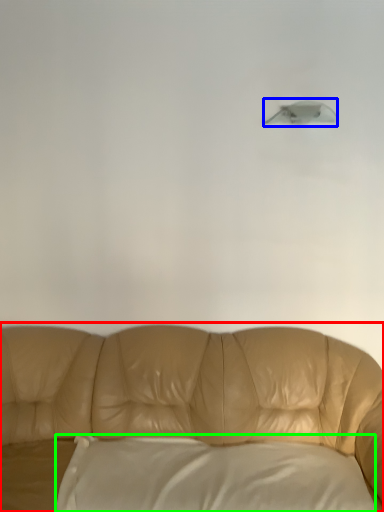
Question: Which is farther away from studio couch (highlighted by a red box)? lamp (highlighted by a blue box) or pillow (highlighted by a green box)?

Choices:
 (A) lamp
 (B) pillow

Answer: (A)